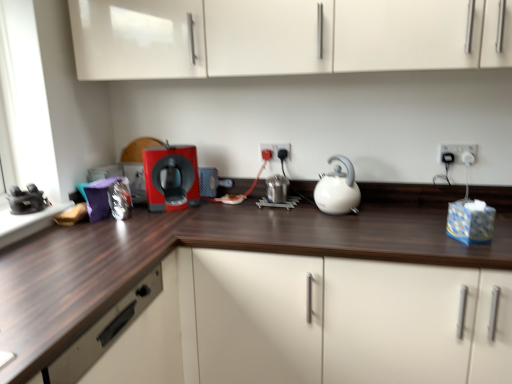
Question: From a real-world perspective, is matte plastic plug at center, the second electric outlet in the right-to-left sequence, beneath matte plastic coffee machine at center?

Choices:
 (A) no
 (B) yes

Answer: (A)

Question: Does matte plastic plug at center, the 1th electric outlet in the back-to-front sequence, have a greater height compared to matte plastic coffee machine at center?

Choices:
 (A) no
 (B) yes

Answer: (A)

Question: Does matte plastic plug at center, the 1th electric outlet in the back-to-front sequence, have a smaller size compared to matte plastic coffee machine at center?

Choices:
 (A) no
 (B) yes

Answer: (B)

Question: Considering the relative positions of matte plastic plug at center, the 1th electric outlet in the back-to-front sequence, and matte plastic coffee machine at center in the image provided, is matte plastic plug at center, the 1th electric outlet in the back-to-front sequence, behind matte plastic coffee machine at center?

Choices:
 (A) yes
 (B) no

Answer: (A)

Question: Does matte plastic plug at center, the 1th electric outlet in the back-to-front sequence, have a larger size compared to matte plastic coffee machine at center?

Choices:
 (A) yes
 (B) no

Answer: (B)

Question: From the image's perspective, relative to matte plastic coffee machine at center, is dark wood countertop at center above or below?

Choices:
 (A) below
 (B) above

Answer: (A)

Question: Is point (72, 337) closer or farther from the camera than point (187, 145)?

Choices:
 (A) farther
 (B) closer

Answer: (B)

Question: In the image, is dark wood countertop at center positioned in front of or behind matte plastic coffee machine at center?

Choices:
 (A) behind
 (B) front

Answer: (B)

Question: Considering the positions of dark wood countertop at center and matte plastic coffee machine at center in the image, is dark wood countertop at center bigger or smaller than matte plastic coffee machine at center?

Choices:
 (A) big
 (B) small

Answer: (A)

Question: From a real-world perspective, is white plastic electric outlet at upper right, which is the second electric outlet in left-to-right order, positioned above or below white glossy kettle at center?

Choices:
 (A) below
 (B) above

Answer: (B)

Question: In terms of height, does white plastic electric outlet at upper right, which is the second electric outlet in left-to-right order, look taller or shorter compared to white glossy kettle at center?

Choices:
 (A) tall
 (B) short

Answer: (B)

Question: Does point (475, 145) appear closer or farther from the camera than point (340, 155)?

Choices:
 (A) closer
 (B) farther

Answer: (A)

Question: Is white plastic electric outlet at upper right, which is the second electric outlet in left-to-right order, in front of or behind white glossy kettle at center in the image?

Choices:
 (A) front
 (B) behind

Answer: (B)

Question: Choose the correct answer: Is matte plastic plug at center, arranged as the first electric outlet when viewed from the left, inside white glossy kettle at center or outside it?

Choices:
 (A) outside
 (B) inside

Answer: (A)

Question: In terms of height, does matte plastic plug at center, the 1th electric outlet in the back-to-front sequence, look taller or shorter compared to white glossy kettle at center?

Choices:
 (A) tall
 (B) short

Answer: (B)